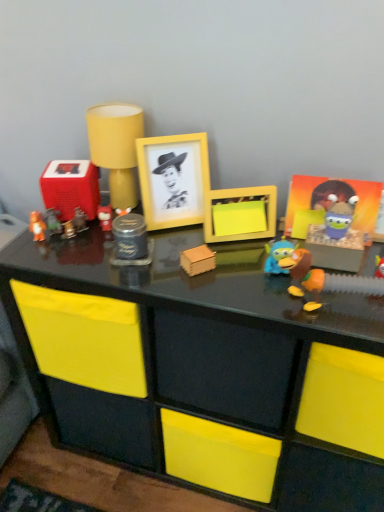
I want to click on free point in front of matte black hello kitty at center, the sixth toy when ordered from left to right, so click(123, 269).